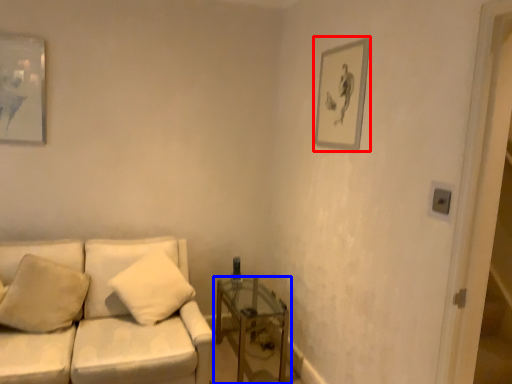
Question: Which of the following is the closest to the observer, picture frame (highlighted by a red box) or table (highlighted by a blue box)?

Choices:
 (A) picture frame
 (B) table

Answer: (A)